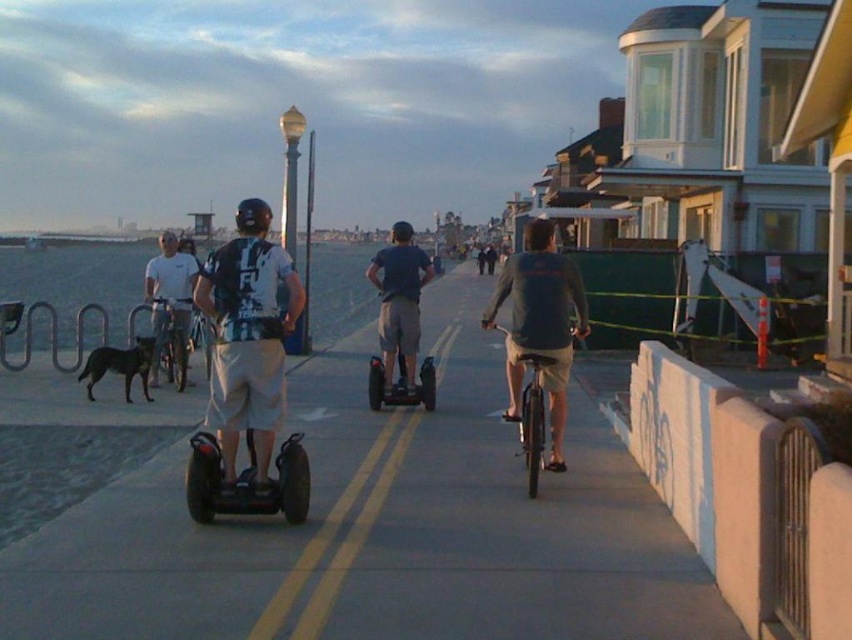
You are a delivery person who needs to choose between the metallic silver bicycle at center and the black matte hoverboard at center for a job that requires carrying packages. Which one is shorter and thus easier to maneuver in tight spaces?

The metallic silver bicycle at center is shorter than the black matte hoverboard at center, making it easier to maneuver in tight spaces.

Consider the image. You are designing a new pathway for the seaside promenade that must accommodate both the metallic silver bicycle at center and the black matte hoverboard at center. Given their widths, which one requires a wider path to maneuver safely?

The black matte hoverboard at center requires a wider path since its width is greater than the metallic silver bicycle at center.

You are a delivery robot that needs to pass through a narrow doorway that is 1.2 meters wide. You see the black rubber segway at center and the black matte hoverboard at center. Which one can you fit through the doorway more easily?

The black matte hoverboard at center can fit through the doorway more easily since it is narrower than the black rubber segway at center, which is wider and may not fit through the 1.2 meter wide doorway.